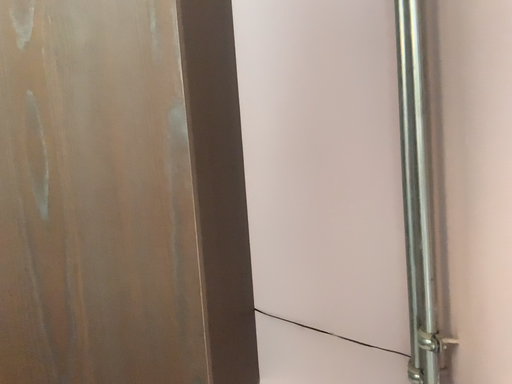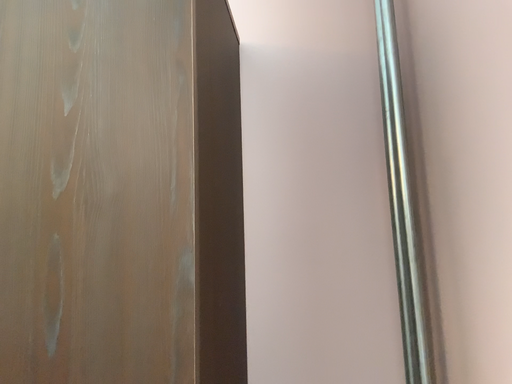
Question: Which way did the camera rotate in the video?

Choices:
 (A) rotated downward
 (B) rotated upward

Answer: (B)